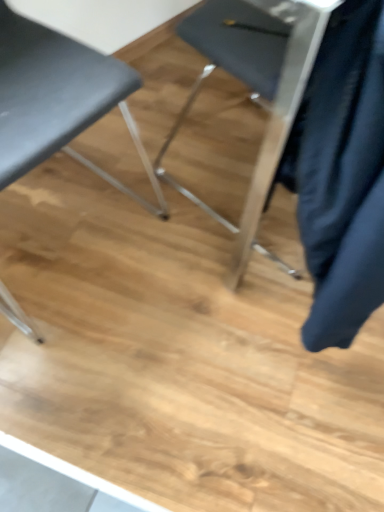
Question: Is point (271, 89) closer or farther from the camera than point (102, 97)?

Choices:
 (A) farther
 (B) closer

Answer: (A)

Question: Is matte black chair at center, arranged as the second chair when viewed from the left, taller or shorter than matte black chair at left, the first chair in the left-to-right sequence?

Choices:
 (A) short
 (B) tall

Answer: (A)

Question: Based on their sizes in the image, would you say matte black chair at center, arranged as the second chair when viewed from the left, is bigger or smaller than matte black chair at left, the first chair in the left-to-right sequence?

Choices:
 (A) big
 (B) small

Answer: (B)

Question: Would you say matte black chair at left, the first chair in the left-to-right sequence, is to the left or to the right of matte black chair at center, the first chair from the right, in the picture?

Choices:
 (A) left
 (B) right

Answer: (A)

Question: From a real-world perspective, is matte black chair at left, the second chair positioned from the right, above or below matte black chair at center, the first chair from the right?

Choices:
 (A) above
 (B) below

Answer: (A)

Question: Is point (81, 112) positioned closer to the camera than point (281, 44)?

Choices:
 (A) closer
 (B) farther

Answer: (A)

Question: Considering the positions of matte black chair at left, the second chair positioned from the right, and matte black chair at center, the first chair from the right, in the image, is matte black chair at left, the second chair positioned from the right, taller or shorter than matte black chair at center, the first chair from the right,?

Choices:
 (A) tall
 (B) short

Answer: (A)